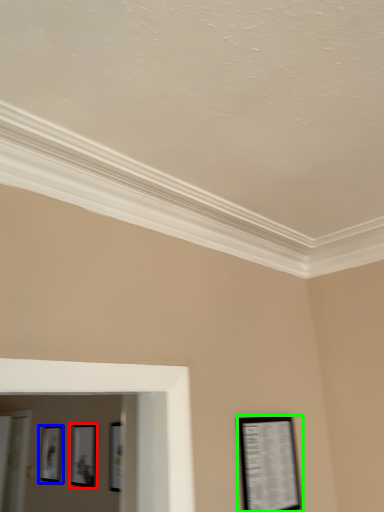
Question: Based on their relative distances, which object is nearer to picture frame (highlighted by a red box)? Choose from picture frame (highlighted by a blue box) and picture frame (highlighted by a green box).

Choices:
 (A) picture frame
 (B) picture frame

Answer: (A)